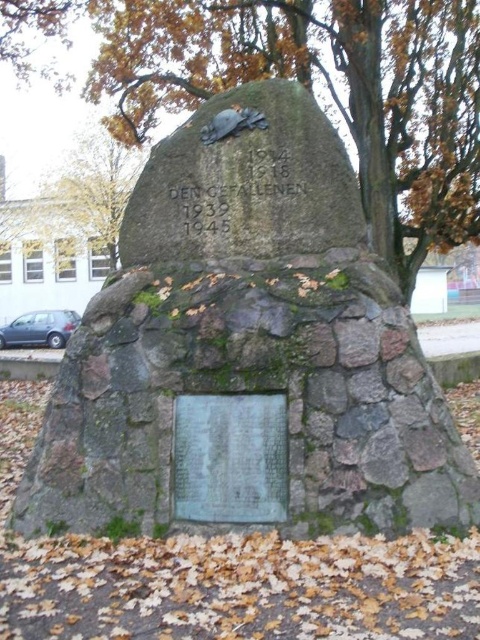
You are an artist planning to sketch this memorial. You need to know the relative sizes of the objects to scale your drawing correctly. Which object is wider, the green mossy stone monument at upper center or the bronze plaque at center?

The green mossy stone monument at upper center is wider than the bronze plaque at center according to the description.

Looking at this image, you are standing in front of the green mossy stone monument at center and want to take a photo of it with your smartphone. Your phone has a maximum zoom range of 5 meters. Will you be able to capture the entire monument in your photo without moving closer?

The distance between you and the green mossy stone monument at center is 3.52 meters, which is within the 5 meter maximum zoom range of your smartphone. Therefore, you can capture the entire monument without moving closer.

What is the spatial relationship between the green mossy stone monument at upper center and the bronze plaque at center?

The green mossy stone monument at upper center is located above the bronze plaque at center.